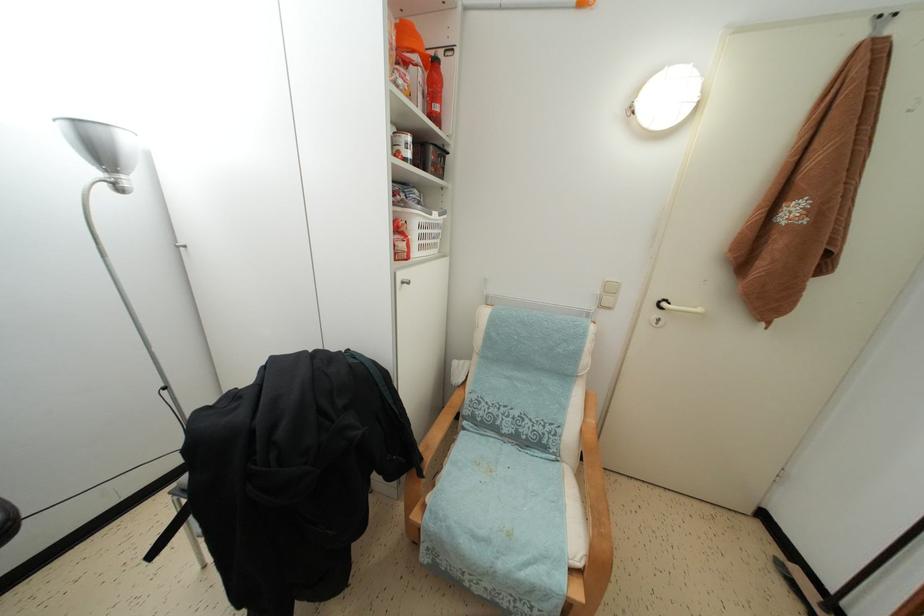
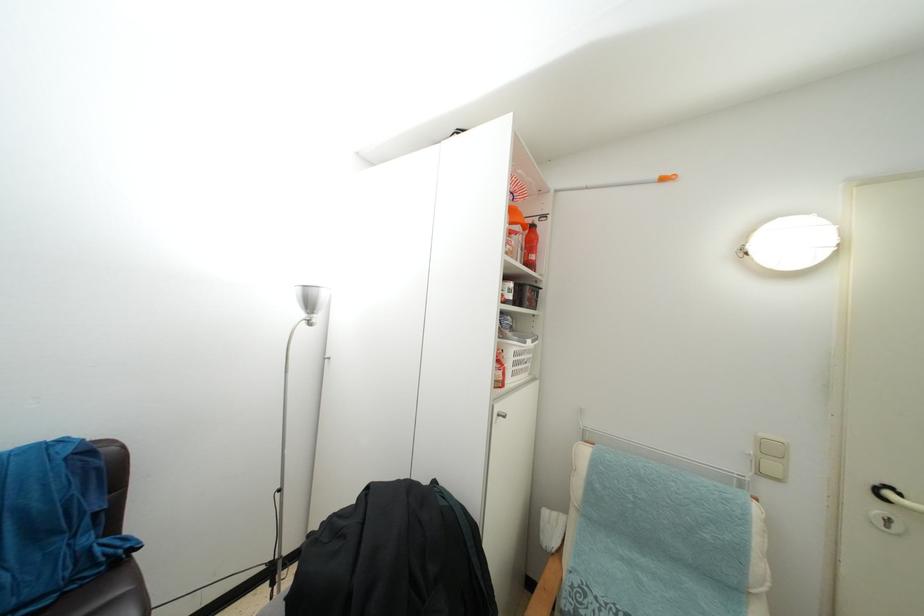
Based on the photo, the images are taken continuously from a first-person perspective. In which direction are you moving?

The movement direction of the cameraman is left, backward.